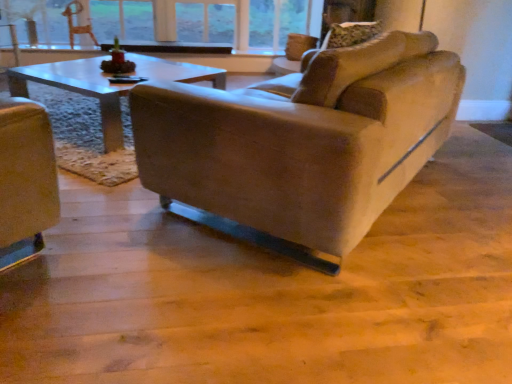
Question: Does wooden textured swivel chair at upper left have a greater width compared to clear glass window at upper center?

Choices:
 (A) no
 (B) yes

Answer: (A)

Question: From the image's perspective, is wooden textured swivel chair at upper left over clear glass window at upper center?

Choices:
 (A) no
 (B) yes

Answer: (A)

Question: Is wooden textured swivel chair at upper left turned away from clear glass window at upper center?

Choices:
 (A) no
 (B) yes

Answer: (B)

Question: Is wooden textured swivel chair at upper left not within clear glass window at upper center?

Choices:
 (A) yes
 (B) no

Answer: (A)

Question: Can you confirm if wooden textured swivel chair at upper left is smaller than clear glass window at upper center?

Choices:
 (A) no
 (B) yes

Answer: (B)

Question: Is clear glass window at upper center completely or partially inside wooden textured swivel chair at upper left?

Choices:
 (A) yes
 (B) no

Answer: (B)

Question: Can you confirm if clear glass window at upper center is wider than wooden textured swivel chair at upper left?

Choices:
 (A) yes
 (B) no

Answer: (A)

Question: From the image's perspective, is clear glass window at upper center on top of wooden textured swivel chair at upper left?

Choices:
 (A) yes
 (B) no

Answer: (A)

Question: Could you tell me if clear glass window at upper center is facing wooden textured swivel chair at upper left?

Choices:
 (A) no
 (B) yes

Answer: (B)

Question: Considering the relative sizes of clear glass window at upper center and wooden textured swivel chair at upper left in the image provided, is clear glass window at upper center bigger than wooden textured swivel chair at upper left?

Choices:
 (A) yes
 (B) no

Answer: (A)

Question: Does clear glass window at upper center have a lesser height compared to wooden textured swivel chair at upper left?

Choices:
 (A) no
 (B) yes

Answer: (A)

Question: From a real-world perspective, is clear glass window at upper center over wooden textured swivel chair at upper left?

Choices:
 (A) no
 (B) yes

Answer: (B)

Question: Is clear glass window at upper center completely or partially outside of suede-like beige couch at center?

Choices:
 (A) no
 (B) yes

Answer: (B)